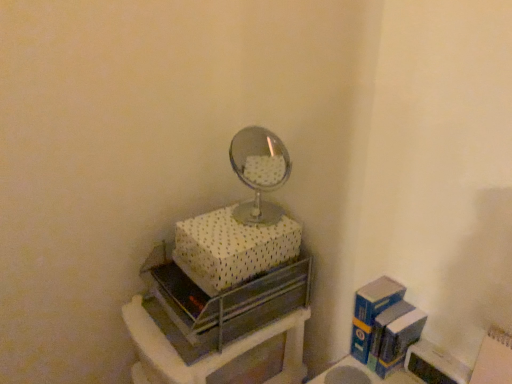
Question: From a real-world perspective, relative to white dotted fabric box at upper center, the second box in the right-to-left sequence, is metallic silver drawer at center vertically above or below?

Choices:
 (A) above
 (B) below

Answer: (B)

Question: Is metallic silver drawer at center in front of or behind white dotted fabric box at upper center, the 1th box from the top, in the image?

Choices:
 (A) behind
 (B) front

Answer: (B)

Question: Which is farther from the white dotted fabric box at upper center, the 1th box from the top?

Choices:
 (A) metallic silver drawer at center
 (B) blue cardboard box at right, the second box from the top

Answer: (B)

Question: Based on their relative distances, which object is farther from the blue cardboard box at right, the first box when ordered from right to left?

Choices:
 (A) metallic silver drawer at center
 (B) white dotted fabric box at upper center, which appears as the second box when ordered from the bottom

Answer: (B)